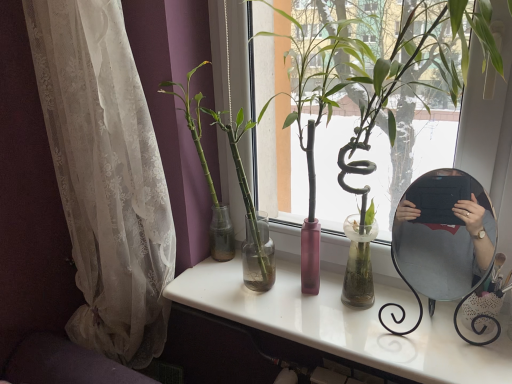
Locate an element on the screen. The width and height of the screenshot is (512, 384). blank space to the left of metallic silver mirror at right is located at coordinates (373, 336).